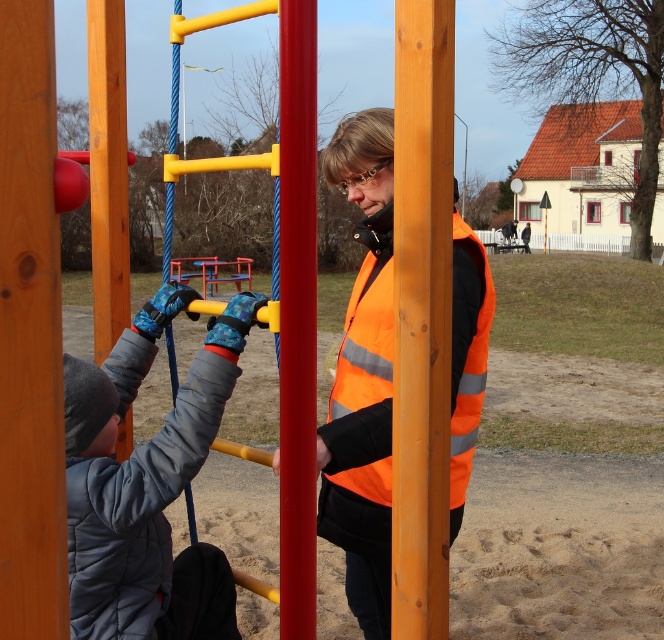
Question: Which object appears closest to the camera in this image?

Choices:
 (A) gray fleece jacket at left
 (B) yellow plastic swing at left

Answer: (A)

Question: Considering the relative positions of gray fleece jacket at left and orange reflective safety vest at center in the image provided, where is gray fleece jacket at left located with respect to orange reflective safety vest at center?

Choices:
 (A) below
 (B) above

Answer: (A)

Question: Which of the following is the closest to the observer?

Choices:
 (A) gray fleece jacket at left
 (B) orange reflective safety vest at center
 (C) wooden pole at center

Answer: (C)

Question: Can you confirm if gray fleece jacket at left is positioned below orange reflective safety vest at center?

Choices:
 (A) yes
 (B) no

Answer: (A)

Question: Estimate the real-world distances between objects in this image. Which object is farther from the red glossy pole at center?

Choices:
 (A) yellow plastic swing at left
 (B) gray fleece jacket at left
 (C) wooden pole at center
 (D) orange reflective safety vest at center

Answer: (A)

Question: Is wooden pole at center bigger than red glossy pole at center?

Choices:
 (A) yes
 (B) no

Answer: (A)